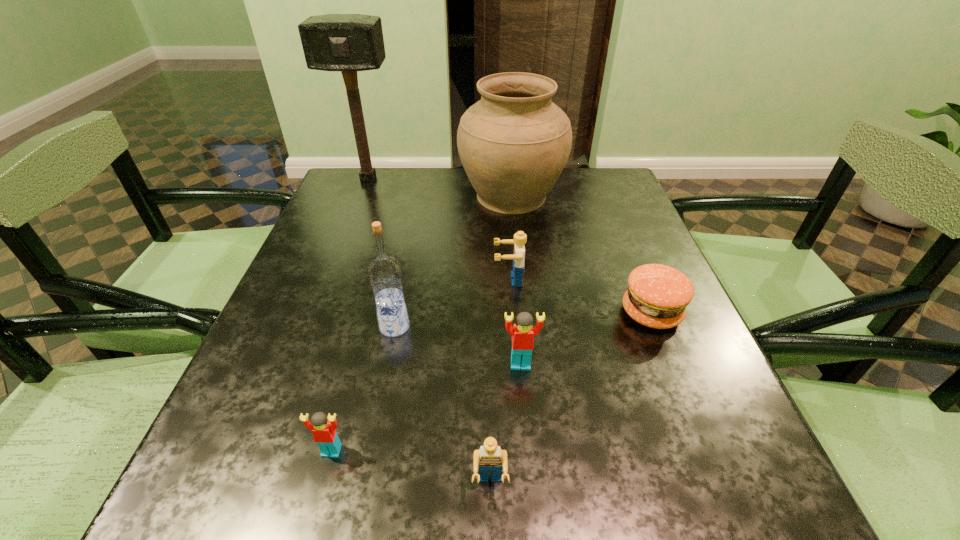
Locate an element on the screen. the smaller red Lego is located at coordinates [323, 428].

The height and width of the screenshot is (540, 960). Find the location of `the nearest object`. the nearest object is located at coordinates (489, 458).

In order to click on the nearer blue Lego in this screenshot , I will do `click(489, 458)`.

Locate an element on the screen. Image resolution: width=960 pixels, height=540 pixels. vacant area located on the right of the mallet is located at coordinates (441, 179).

I want to click on blank area located on the front of the seventh shortest object, so click(521, 296).

The image size is (960, 540). I want to click on vacant space located 0.210m on the right of the blue vodka, so click(522, 327).

At what (x,y) coordinates should I click in order to perform the action: click on vacant space located 0.110m on the face of the sixth farthest object. Please return your answer as a coordinate pair (x, y). Looking at the image, I should click on (526, 430).

Find the location of a particular element. Image resolution: width=960 pixels, height=540 pixels. vacant space located on the face of the farther blue Lego is located at coordinates (426, 280).

The height and width of the screenshot is (540, 960). In order to click on vacant space located on the face of the farther blue Lego in this screenshot , I will do `click(441, 280)`.

The image size is (960, 540). I want to click on free space located 0.230m on the face of the farther blue Lego, so tap(383, 280).